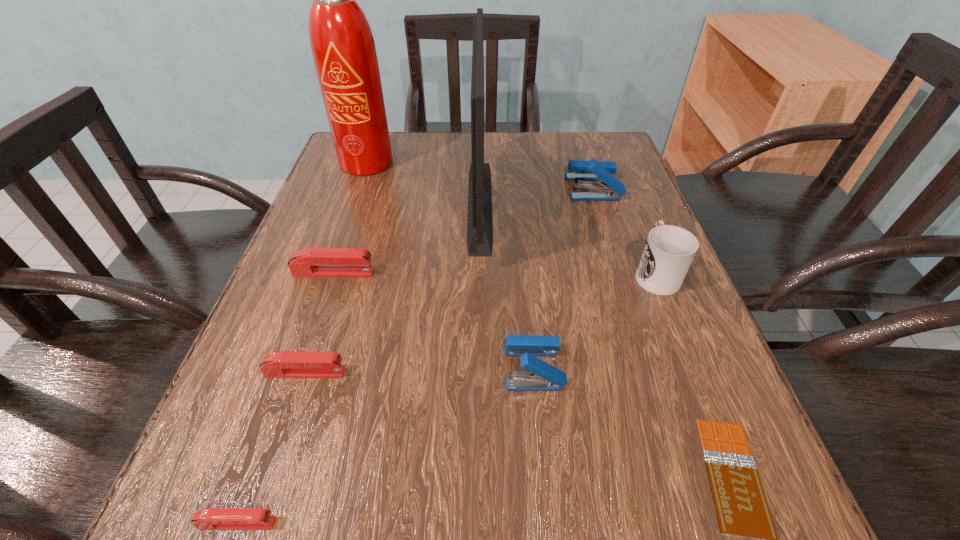
Choose which stapler is the nearest neighbor to the chocolate bar. Please provide its 2D coordinates. Your answer should be formatted as a tuple, i.e. [(x, y)], where the tuple contains the x and y coordinates of a point satisfying the conditions above.

[(542, 376)]

Locate an element on the screen. Image resolution: width=960 pixels, height=540 pixels. stapler identified as the second closest to the cup is located at coordinates (542, 376).

Identify the location of the second closest red stapler to the shortest stapler. (311, 262).

Locate which red stapler ranks second in proximity to the nearest stapler. Please provide its 2D coordinates. Your answer should be formatted as a tuple, i.e. [(x, y)], where the tuple contains the x and y coordinates of a point satisfying the conditions above.

[(311, 262)]

In order to click on vacant position in the image that satisfies the following two spatial constraints: 1. on the front-facing side of the left blue stapler; 2. on the left side of the monitor in this screenshot , I will do `click(480, 368)`.

The height and width of the screenshot is (540, 960). I want to click on free space that satisfies the following two spatial constraints: 1. on the front-facing side of the fifth object from left to right; 2. on the back side of the smaller blue stapler, so click(480, 368).

I want to click on blank area in the image that satisfies the following two spatial constraints: 1. on the front-facing side of the fifth object from left to right; 2. on the right side of the nearer blue stapler, so click(480, 368).